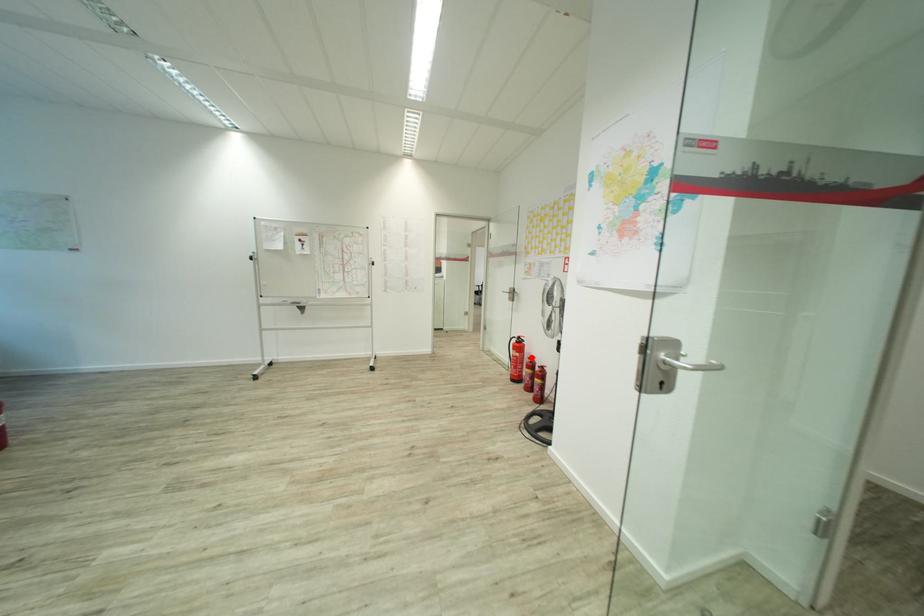
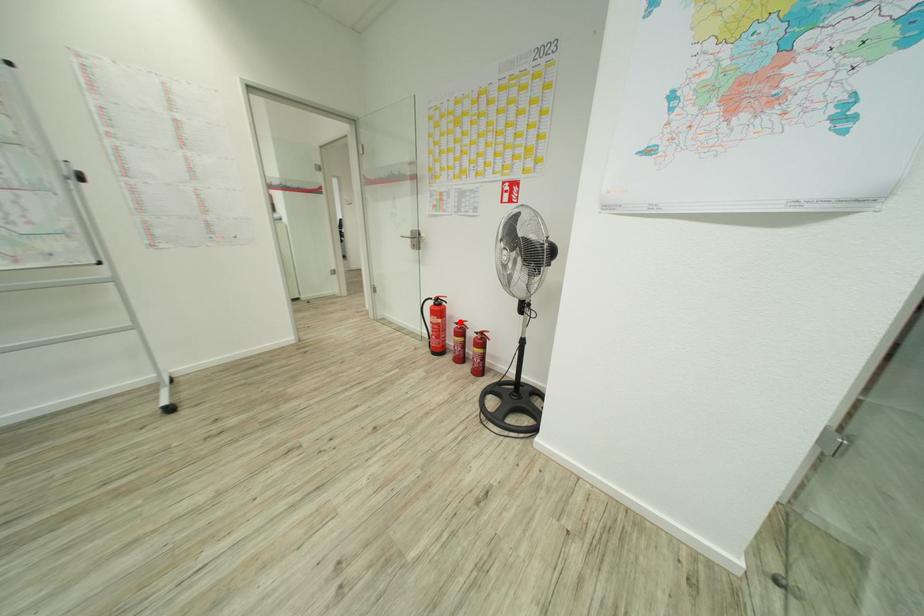
I am providing you with two images of the same scene from different viewpoints. A red point is marked on the first image and another point is marked on the second image. Is the red point in image1 aligned with the point shown in image2?

Yes